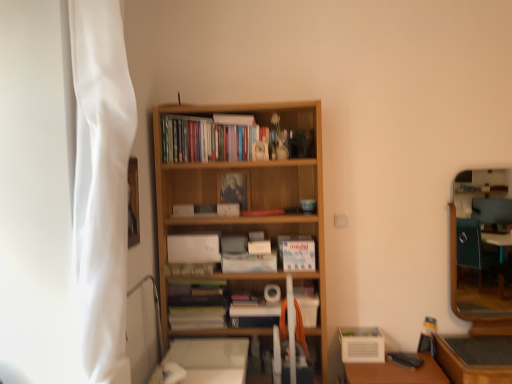
Where is `free spot above white matte paperback book at center, which appears as the 2th paperback book when ordered from the bottom (from a real-world perspective)`? Image resolution: width=512 pixels, height=384 pixels. free spot above white matte paperback book at center, which appears as the 2th paperback book when ordered from the bottom (from a real-world perspective) is located at coordinates (194, 232).